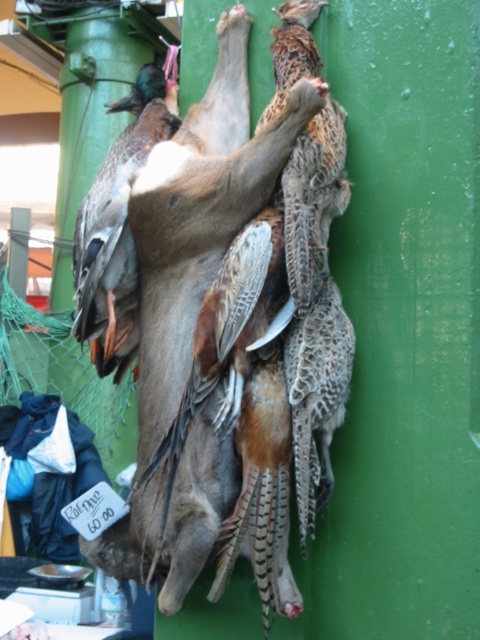
Locate an element on the screen. feathered brown bird at center is located at coordinates (311, 198).

Is shiny brown duck at left shorter than green matte pillar at upper left?

Yes, shiny brown duck at left is shorter than green matte pillar at upper left.

Is shiny brown duck at left to the left of green matte pillar at upper left from the viewer's perspective?

In fact, shiny brown duck at left is to the right of green matte pillar at upper left.

Is point (88, 317) positioned in front of point (129, 61)?

Yes, point (88, 317) is in front of point (129, 61).

What are the coordinates of `shiny brown duck at left` in the screenshot? It's located at (117, 227).

How much distance is there between shiny brown duck at left and feathered brown bird at center?

14.95 inches

Based on the photo, does shiny brown duck at left lie in front of feathered brown bird at center?

No.

Measure the distance between shiny brown duck at left and camera.

shiny brown duck at left is 5.86 feet from camera.

Where is `shiny brown duck at left`? This screenshot has height=640, width=480. shiny brown duck at left is located at coordinates (117, 227).